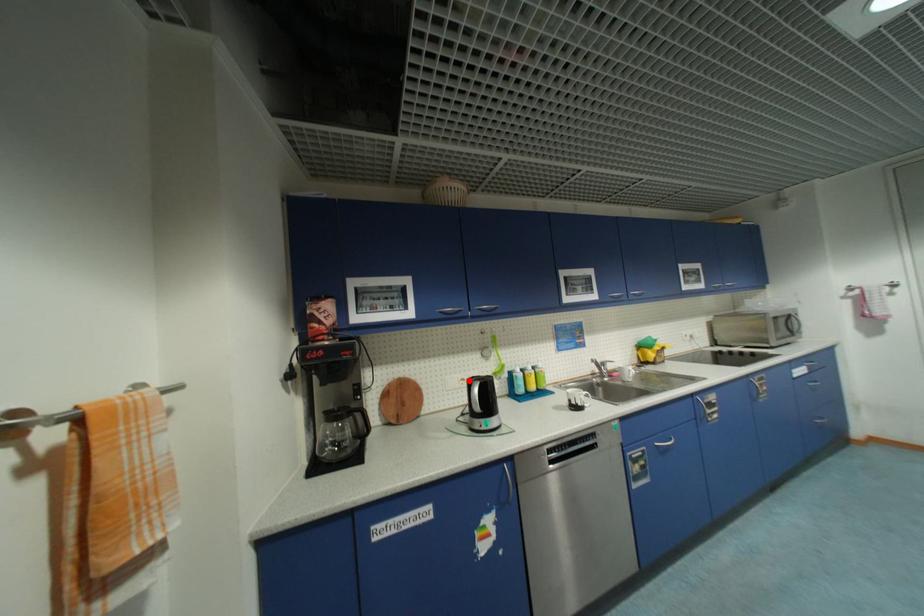
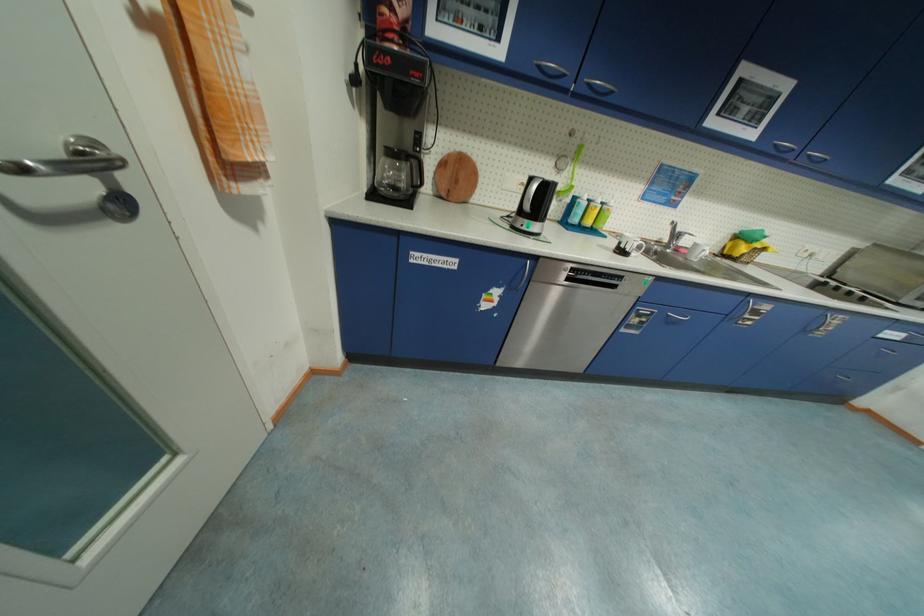
Where in the second image is the point corresponding to the highlighted location from the first image?

(529, 185)